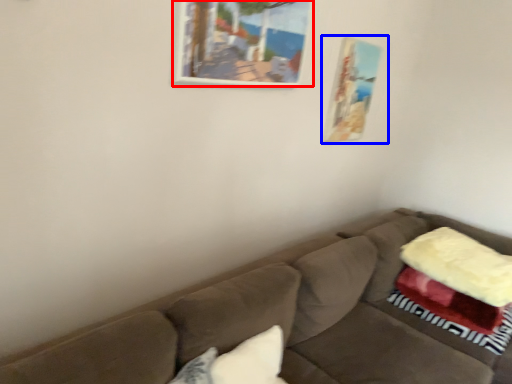
Question: Which object appears closest to the camera in this image, picture frame (highlighted by a red box) or picture frame (highlighted by a blue box)?

Choices:
 (A) picture frame
 (B) picture frame

Answer: (A)